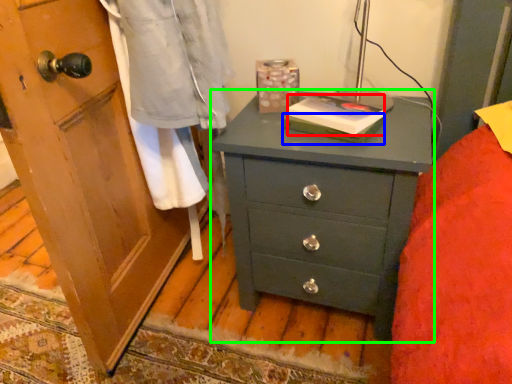
Question: Which object is the closest to the book (highlighted by a red box)? Choose among these: book (highlighted by a blue box) or chest of drawers (highlighted by a green box).

Choices:
 (A) book
 (B) chest of drawers

Answer: (A)